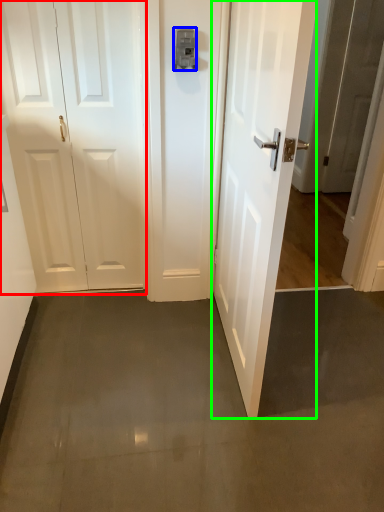
Question: Which object is positioned farthest from door (highlighted by a red box)? Select from latch (highlighted by a blue box) and door (highlighted by a green box).

Choices:
 (A) latch
 (B) door

Answer: (B)